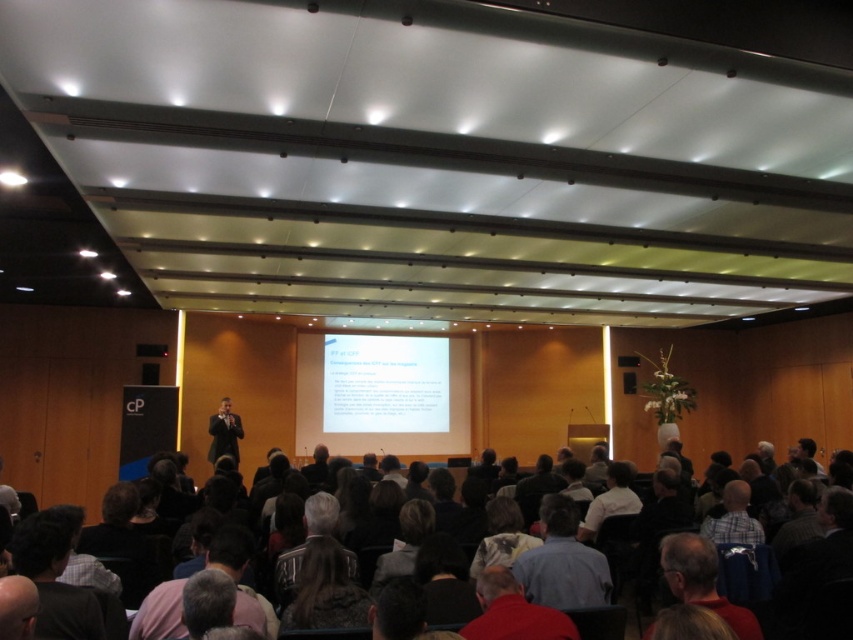
Does blue plaid shirt at lower right have a lesser height compared to bald head at lower left?

No.

Is blue plaid shirt at lower right thinner than bald head at lower left?

No.

Find the location of `blue plaid shirt at lower right`. blue plaid shirt at lower right is located at coordinates (733, 516).

Is white matte projection screen at center bigger than dark gray clothing at center?

Yes.

Is point (456, 426) less distant than point (793, 625)?

No, it is not.

This screenshot has width=853, height=640. In order to click on white matte projection screen at center in this screenshot , I will do `click(380, 428)`.

Can you confirm if gray hair at lower center is positioned above bald head at lower left?

Actually, gray hair at lower center is below bald head at lower left.

Does gray hair at lower center come behind bald head at lower left?

Yes, it is behind bald head at lower left.

From the picture: Who is more distant from viewer, (264,625) or (20,616)?

The point (264,625) is behind.

This screenshot has height=640, width=853. I want to click on gray hair at lower center, so click(x=160, y=612).